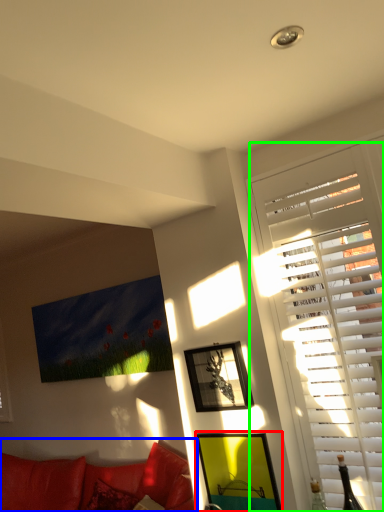
Question: Which object is the farthest from picture frame (highlighted by a red box)? Choose among these: studio couch (highlighted by a blue box) or window (highlighted by a green box).

Choices:
 (A) studio couch
 (B) window

Answer: (A)